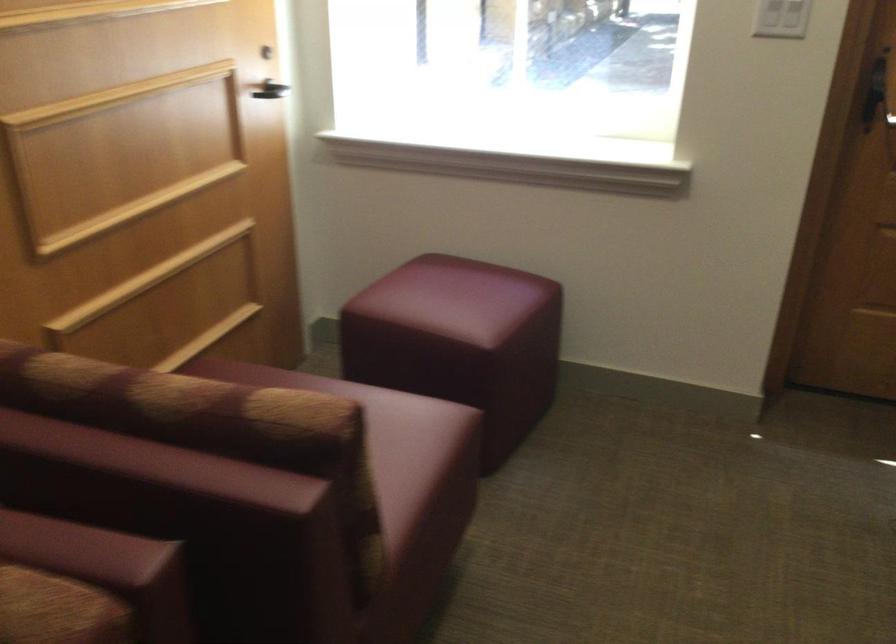
Find the location of `sofa armrest`. sofa armrest is located at coordinates (82, 550).